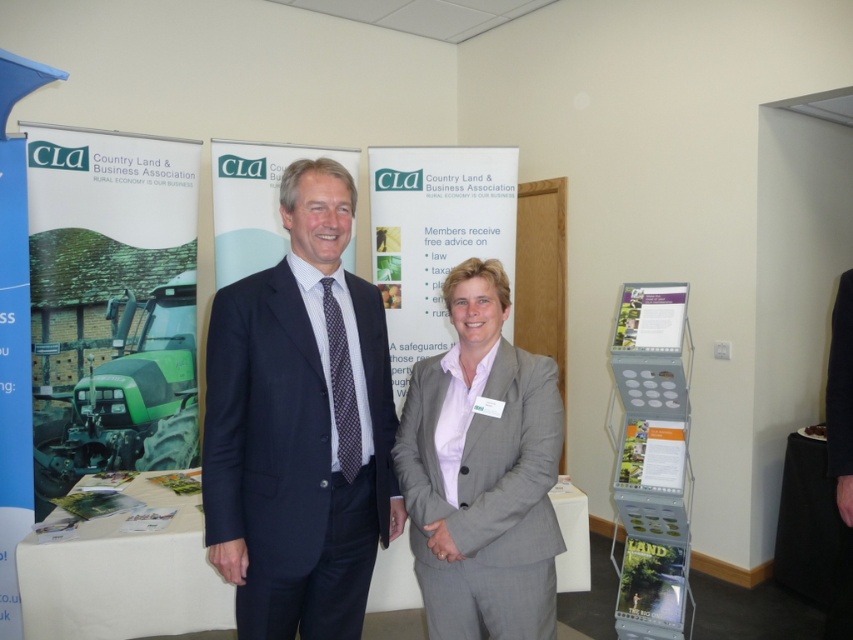
Does white paperboard at center appear under green paper poster at center?

No.

Which is more to the left, white paperboard at center or green paper poster at center?

Positioned to the left is white paperboard at center.

What do you see at coordinates (434, 236) in the screenshot? The image size is (853, 640). I see `white paperboard at center` at bounding box center [434, 236].

At what (x,y) coordinates should I click in order to perform the action: click on white paperboard at center. Please return your answer as a coordinate pair (x, y). Looking at the image, I should click on (434, 236).

Which is more to the left, dark blue suit at center or matte paper poster at lower right?

dark blue suit at center is more to the left.

Can you confirm if dark blue suit at center is shorter than matte paper poster at lower right?

In fact, dark blue suit at center may be taller than matte paper poster at lower right.

Is point (259, 356) in front of point (657, 609)?

Yes.

This screenshot has width=853, height=640. Find the location of `dark blue suit at center`. dark blue suit at center is located at coordinates (300, 426).

Can you confirm if white paperboard at center is positioned to the right of white paper at right?

In fact, white paperboard at center is to the left of white paper at right.

Can you confirm if white paperboard at center is smaller than white paper at right?

No, white paperboard at center is not smaller than white paper at right.

Does point (422, 344) come farther from viewer compared to point (653, 326)?

Yes, point (422, 344) is behind point (653, 326).

Where is `white paperboard at center`? white paperboard at center is located at coordinates (434, 236).